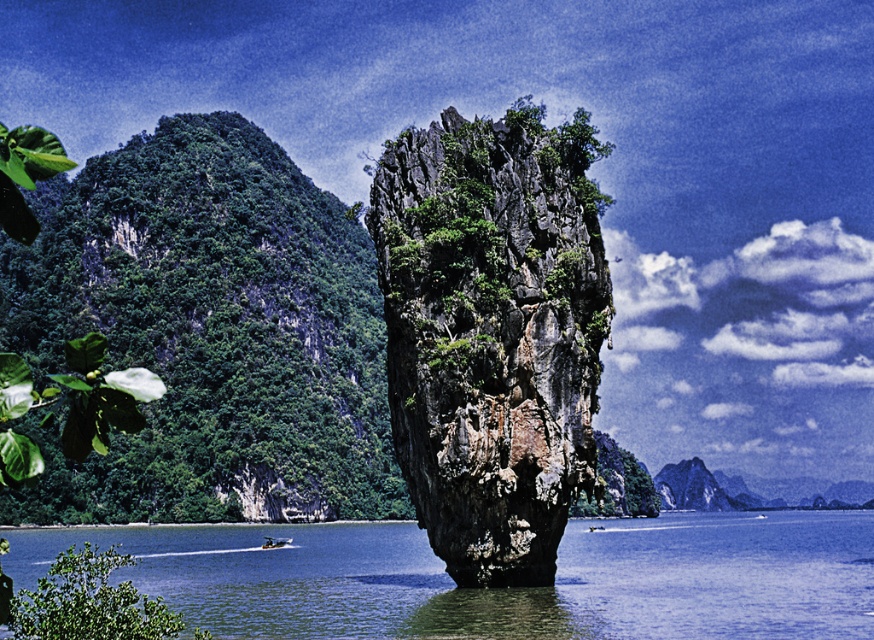
Question: Estimate the real-world distances between objects in this image. Which object is closer to the green mossy rock at center?

Choices:
 (A) clear blue water at center
 (B) green leafy vegetation at left
 (C) green leafy vegetation at center

Answer: (C)

Question: Among these points, which one is nearest to the camera?

Choices:
 (A) (565, 444)
 (B) (121, 624)
 (C) (179, 451)

Answer: (B)

Question: Can you confirm if clear blue water at center is positioned to the right of green leafy vegetation at center?

Choices:
 (A) no
 (B) yes

Answer: (A)

Question: Does green leafy bush at lower left appear on the right side of green leafy vegetation at center?

Choices:
 (A) yes
 (B) no

Answer: (B)

Question: From the image, what is the correct spatial relationship of clear blue water at center in relation to green leafy vegetation at center?

Choices:
 (A) left
 (B) right

Answer: (A)

Question: Which of the following is the closest to the observer?

Choices:
 (A) (281, 244)
 (B) (553, 152)

Answer: (B)